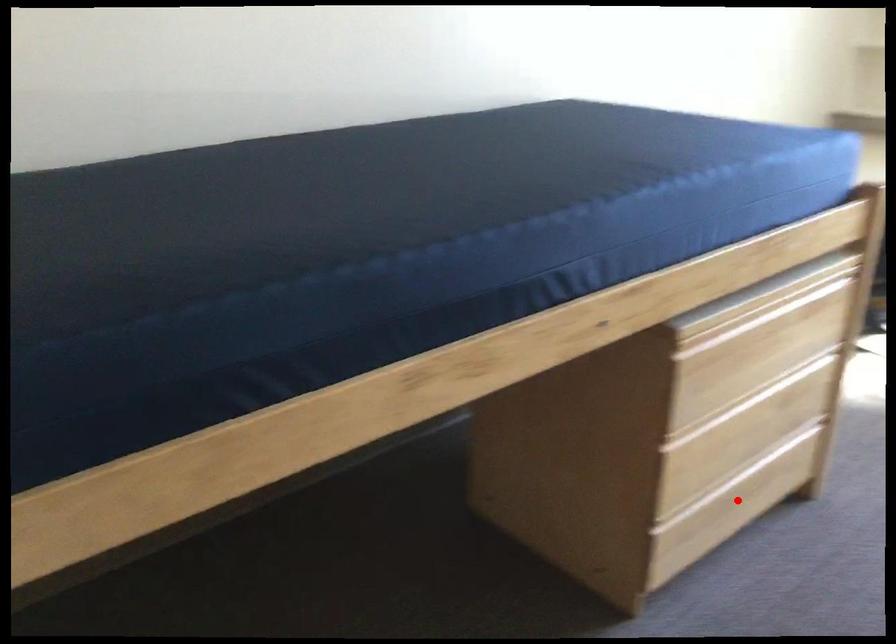
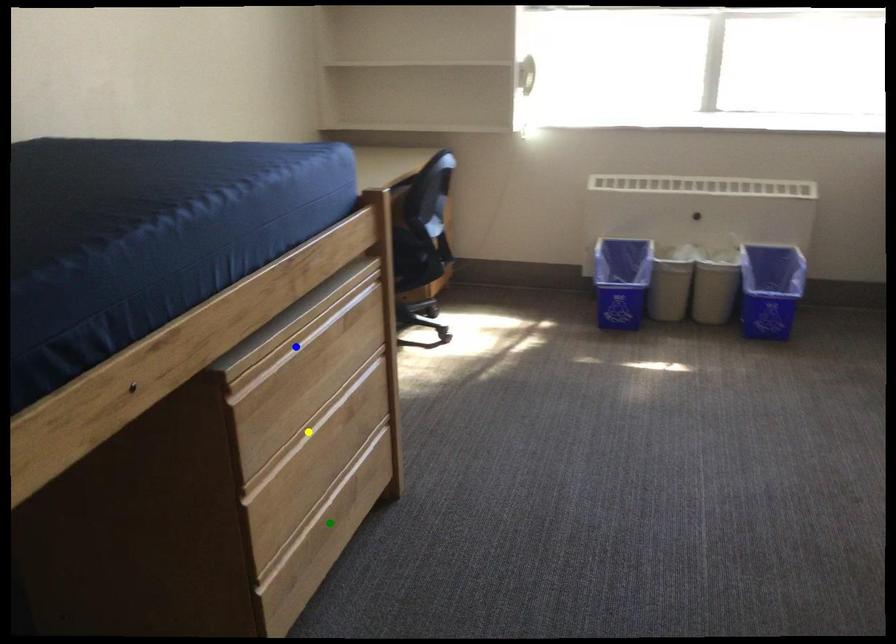
Question: I am providing you with two images of the same scene from different viewpoints. A red point is marked on the first image. You are given multiple points on the second image. In image 2, which mark is for the same physical point as the one in image 1?

Choices:
 (A) green point
 (B) yellow point
 (C) blue point

Answer: (A)